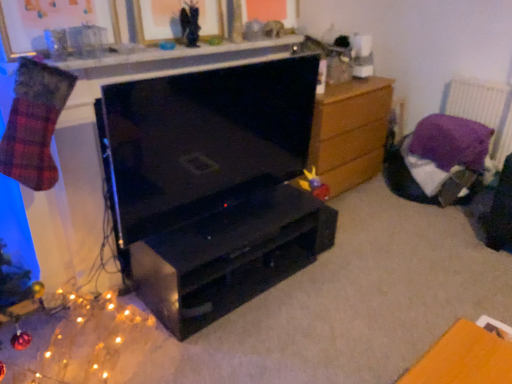
The image size is (512, 384). Find the location of `purple fabric at upper right`. purple fabric at upper right is located at coordinates (482, 109).

This screenshot has height=384, width=512. Describe the element at coordinates (482, 109) in the screenshot. I see `purple fabric at upper right` at that location.

At what (x,y) coordinates should I click in order to perform the action: click on wooden picture frame at upper center, marked as the first picture frame in a left-to-right arrangement. Please return your answer as a coordinate pair (x, y). Image resolution: width=512 pixels, height=384 pixels. Looking at the image, I should click on (51, 21).

I want to click on smooth white counter at upper center, so coord(175,58).

Describe the element at coordinates (314, 184) in the screenshot. I see `plush yellow duck at center, marked as the first toy in a right-to-left arrangement` at that location.

Image resolution: width=512 pixels, height=384 pixels. What do you see at coordinates (77, 342) in the screenshot?
I see `glittering gold lights at lower left` at bounding box center [77, 342].

This screenshot has height=384, width=512. In order to click on metallic gold picture frame at upper center, the second picture frame positioned from the left in this screenshot , I will do `click(157, 20)`.

Between glittering gold lights at lower left and metallic gold picture frame at upper center, the second picture frame positioned from the left, which one has smaller width?

With smaller width is metallic gold picture frame at upper center, the second picture frame positioned from the left.

Considering the positions of objects glittering gold lights at lower left and metallic gold picture frame at upper center, which is counted as the first picture frame, starting from the right, in the image provided, who is more to the right, glittering gold lights at lower left or metallic gold picture frame at upper center, which is counted as the first picture frame, starting from the right,?

metallic gold picture frame at upper center, which is counted as the first picture frame, starting from the right, is more to the right.

Is glittering gold lights at lower left positioned before metallic gold picture frame at upper center, which is counted as the first picture frame, starting from the right?

Yes, it is in front of metallic gold picture frame at upper center, which is counted as the first picture frame, starting from the right.

Is glittering gold lights at lower left facing towards metallic gold picture frame at upper center, which is counted as the first picture frame, starting from the right?

No, glittering gold lights at lower left is not facing towards metallic gold picture frame at upper center, which is counted as the first picture frame, starting from the right.

Does purple fabric at upper right have a larger size compared to black glossy tv at center?

Actually, purple fabric at upper right might be smaller than black glossy tv at center.

From the image's perspective, which object appears higher, purple fabric at upper right or black glossy tv at center?

purple fabric at upper right.

Is purple fabric at upper right oriented towards black glossy tv at center?

Yes, purple fabric at upper right is aimed at black glossy tv at center.

Does purple fabric at upper right have a greater height compared to black glossy tv at center?

No, purple fabric at upper right is not taller than black glossy tv at center.

From a real-world perspective, between glittering gold lights at lower left and smooth white counter at upper center, who is vertically lower?

glittering gold lights at lower left, from a real-world perspective.

Which of these two, glittering gold lights at lower left or smooth white counter at upper center, stands shorter?

Standing shorter between the two is smooth white counter at upper center.

Considering the relative sizes of glittering gold lights at lower left and smooth white counter at upper center in the image provided, is glittering gold lights at lower left smaller than smooth white counter at upper center?

No, glittering gold lights at lower left is not smaller than smooth white counter at upper center.

How distant is glittering gold lights at lower left from smooth white counter at upper center?

3.59 feet.

Looking at their sizes, would you say black glossy tv at center is wider or thinner than purple fabric at upper right?

In the image, black glossy tv at center appears to be more narrow than purple fabric at upper right.

Is point (158, 205) more distant than point (470, 109)?

No, (158, 205) is in front of (470, 109).

Does black glossy tv at center appear on the right side of purple fabric at upper right?

Incorrect, black glossy tv at center is not on the right side of purple fabric at upper right.

Where is `desk below the plush yellow duck at center, arranged as the first toy when viewed from the back (from a real-world perspective)`? The height and width of the screenshot is (384, 512). desk below the plush yellow duck at center, arranged as the first toy when viewed from the back (from a real-world perspective) is located at coordinates (229, 256).

Is plush yellow duck at center, the second toy from the top, not inside black matte desk at center?

Yes, plush yellow duck at center, the second toy from the top, is located beyond the bounds of black matte desk at center.

Considering the positions of point (311, 178) and point (173, 314), is point (311, 178) closer or farther from the camera than point (173, 314)?

Point (311, 178) is positioned farther from the camera compared to point (173, 314).

Can you confirm if matte black angel at upper center, positioned as the 2th toy in right-to-left order, is thinner than smooth white counter at upper center?

Yes.

Does point (187, 31) appear closer or farther from the camera than point (111, 66)?

Point (187, 31).

Based on the photo, do you think matte black angel at upper center, positioned as the 2th toy in right-to-left order, is within smooth white counter at upper center, or outside of it?

matte black angel at upper center, positioned as the 2th toy in right-to-left order, is spatially situated outside smooth white counter at upper center.

From the picture: Is matte black angel at upper center, acting as the first toy starting from the front, not close to smooth white counter at upper center?

matte black angel at upper center, acting as the first toy starting from the front, is actually quite close to smooth white counter at upper center.

Which is further, (42,25) or (261,55)?

Positioned behind is point (261,55).

From a real-world perspective, is wooden picture frame at upper center, marked as the first picture frame in a left-to-right arrangement, physically located above or below smooth white counter at upper center?

wooden picture frame at upper center, marked as the first picture frame in a left-to-right arrangement, is above smooth white counter at upper center.

Is wooden picture frame at upper center, which is the second picture frame from right to left, wider or thinner than smooth white counter at upper center?

Considering their sizes, wooden picture frame at upper center, which is the second picture frame from right to left, looks slimmer than smooth white counter at upper center.

Does wooden picture frame at upper center, which is the second picture frame from right to left, turn towards smooth white counter at upper center?

No, wooden picture frame at upper center, which is the second picture frame from right to left, is not aimed at smooth white counter at upper center.

Where is `picture frame on the right of glittering gold lights at lower left`? The image size is (512, 384). picture frame on the right of glittering gold lights at lower left is located at coordinates (157, 20).

This screenshot has height=384, width=512. I want to click on entertainment center lying below the purple fabric at upper right (from the image's perspective), so (212, 186).

Based on their spatial positions, is matte black angel at upper center, positioned as the 2th toy in right-to-left order, or wooden chest of drawers at right further from plush yellow duck at center, which is the 1th toy from bottom to top?

Based on the image, matte black angel at upper center, positioned as the 2th toy in right-to-left order, appears to be further to plush yellow duck at center, which is the 1th toy from bottom to top.

Based on the photo, when comparing their distances from black glossy tv at center, does metallic gold picture frame at upper center, which is counted as the first picture frame, starting from the right, or black matte desk at center seem further?

A: Among the two, metallic gold picture frame at upper center, which is counted as the first picture frame, starting from the right, is located further to black glossy tv at center.

From the picture: Estimate the real-world distances between objects in this image. Which object is closer to metallic gold picture frame at upper center, which is counted as the first picture frame, starting from the right, matte black angel at upper center, which is the 1th toy in top-to-bottom order, or wooden picture frame at upper center, marked as the first picture frame in a left-to-right arrangement?

Based on the image, matte black angel at upper center, which is the 1th toy in top-to-bottom order, appears to be nearer to metallic gold picture frame at upper center, which is counted as the first picture frame, starting from the right.

Considering their positions, is smooth white counter at upper center positioned further to wooden chest of drawers at right than glittering gold lights at lower left?

glittering gold lights at lower left.

Which object lies further to the anchor point wooden chest of drawers at right, black matte desk at center or wooden picture frame at upper center, which is the second picture frame from right to left?

wooden picture frame at upper center, which is the second picture frame from right to left.

Considering their positions, is black glossy tv at center positioned further to glittering gold lights at lower left than metallic gold picture frame at upper center, which is counted as the first picture frame, starting from the right?

Based on the image, metallic gold picture frame at upper center, which is counted as the first picture frame, starting from the right, appears to be further to glittering gold lights at lower left.

When comparing their distances from smooth white counter at upper center, does black glossy tv at center or plush yellow duck at center, acting as the second toy starting from the left, seem further?

Among the two, plush yellow duck at center, acting as the second toy starting from the left, is located further to smooth white counter at upper center.

When comparing their distances from wooden picture frame at upper center, which is the second picture frame from right to left, does plush yellow duck at center, acting as the second toy starting from the left, or metallic gold picture frame at upper center, which is counted as the first picture frame, starting from the right, seem closer?

Based on the image, metallic gold picture frame at upper center, which is counted as the first picture frame, starting from the right, appears to be nearer to wooden picture frame at upper center, which is the second picture frame from right to left.

The width and height of the screenshot is (512, 384). I want to click on toy situated between black matte desk at center and purple fabric at upper right from left to right, so click(x=314, y=184).

The image size is (512, 384). I want to click on the chest of drawers located between black matte desk at center and purple fabric at upper right in the left-right direction, so click(350, 132).

Identify the location of desk between black glossy tv at center and glittering gold lights at lower left in the up-down direction. Image resolution: width=512 pixels, height=384 pixels. (229, 256).

What are the coordinates of `toy located between wooden picture frame at upper center, which is the second picture frame from right to left, and black glossy tv at center in the left-right direction` in the screenshot? It's located at (190, 24).